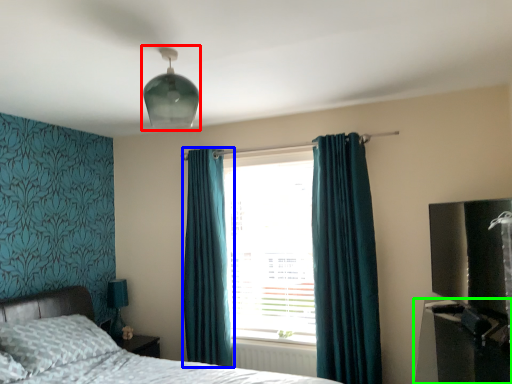
Question: Based on their relative distances, which object is farther from light fixture (highlighted by a red box)? Choose from curtain (highlighted by a blue box) and entertainment center (highlighted by a green box).

Choices:
 (A) curtain
 (B) entertainment center

Answer: (B)